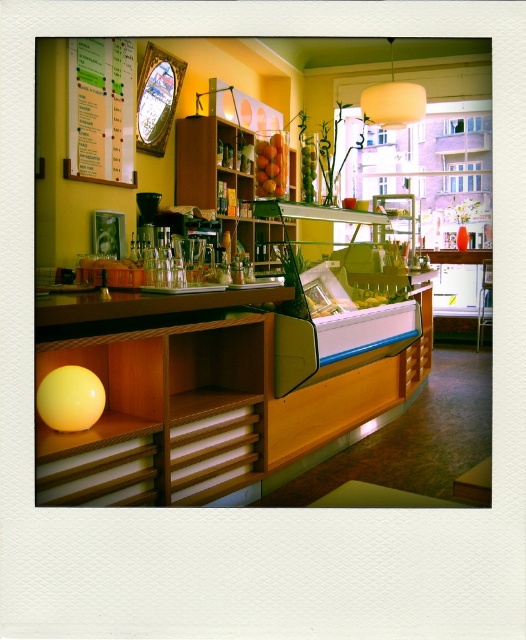
Question: In this image, where is white paper at upper left located relative to shiny orange fruit at center?

Choices:
 (A) left
 (B) right

Answer: (A)

Question: Which point appears closest to the camera in this image?

Choices:
 (A) (124, 108)
 (B) (265, 148)
 (C) (389, 122)
 (D) (85, 202)

Answer: (D)

Question: From the image, what is the correct spatial relationship of matte white lampshade at upper center in relation to shiny orange fruit at center?

Choices:
 (A) above
 (B) below

Answer: (A)

Question: Which object is the closest to the white paper at upper left?

Choices:
 (A) matte black coffee machine at center
 (B) shiny orange fruit at center
 (C) yellow matte sphere at lower left

Answer: (B)

Question: Which of these objects is positioned closest to the matte white lampshade at upper center?

Choices:
 (A) yellow matte sphere at lower left
 (B) white paper at upper left
 (C) matte black coffee machine at center

Answer: (C)

Question: Can you confirm if yellow matte sphere at lower left is smaller than matte white lampshade at upper center?

Choices:
 (A) yes
 (B) no

Answer: (B)